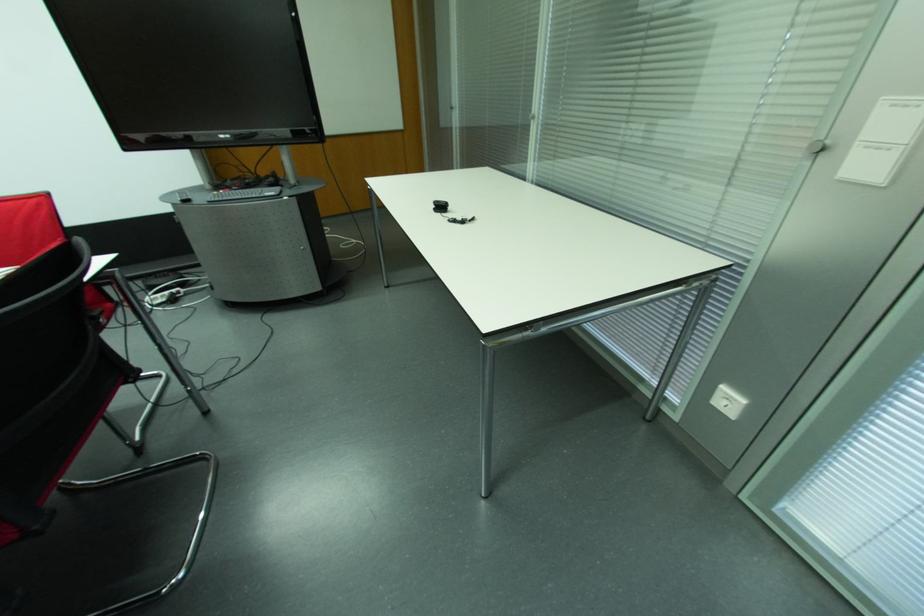
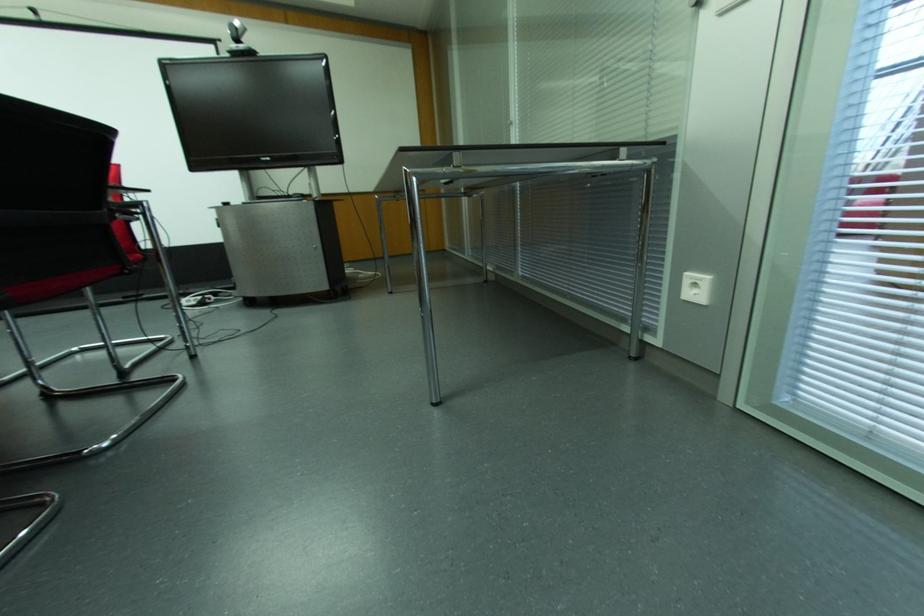
Question: How did the camera likely rotate?

Choices:
 (A) Left
 (B) Right
 (C) Up
 (D) Down

Answer: (C)